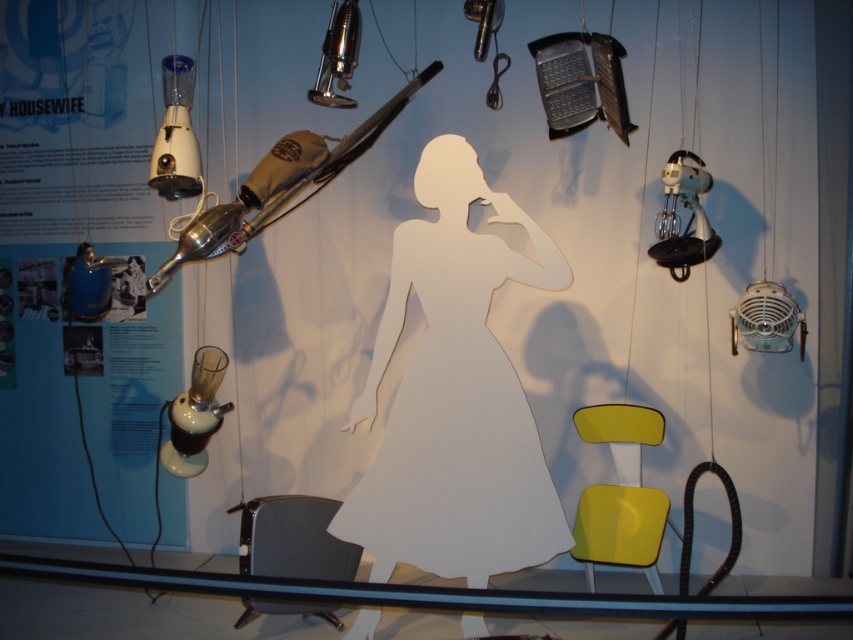
Is yellow matte chair at lower right further to camera compared to white plastic blender at upper left?

No, it is not.

Can you confirm if yellow matte chair at lower right is positioned below white plastic blender at upper left?

Yes.

Is point (590, 442) positioned behind point (172, 84)?

Yes, it is behind point (172, 84).

Where is `yellow matte chair at lower right`? The image size is (853, 640). yellow matte chair at lower right is located at coordinates click(x=619, y=493).

Which is behind, point (450, 189) or point (173, 433)?

Positioned behind is point (173, 433).

Is white paper figure at center shorter than matte white lamp at lower left?

In fact, white paper figure at center may be taller than matte white lamp at lower left.

Between point (456, 518) and point (204, 346), which one is positioned behind?

Point (204, 346)

The height and width of the screenshot is (640, 853). In order to click on white paper figure at center in this screenshot , I will do `click(456, 396)`.

Can you confirm if transparent glass table at lower center is positioned to the left of matte white lamp at lower left?

In fact, transparent glass table at lower center is to the right of matte white lamp at lower left.

Is point (265, 588) positioned behind point (218, 353)?

No, it is not.

You are a GUI agent. You are given a task and a screenshot of the screen. Output one action in this format:
    pyautogui.click(x=<x>, y=<y>)
    Task: Click on the transparent glass table at lower center
    
    Given the screenshot: What is the action you would take?
    pyautogui.click(x=439, y=595)